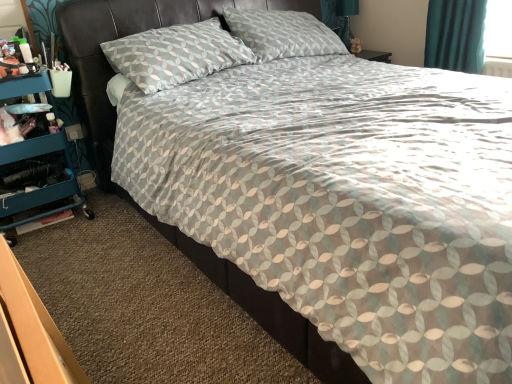
Question: Should I look upward or downward to see teal fabric curtain at upper right?

Choices:
 (A) down
 (B) up

Answer: (B)

Question: Does teal plastic cart at left lie behind teal fabric curtain at upper right?

Choices:
 (A) yes
 (B) no

Answer: (B)

Question: Is teal fabric curtain at upper right completely or partially inside teal plastic cart at left?

Choices:
 (A) yes
 (B) no

Answer: (B)

Question: Considering the relative sizes of teal plastic cart at left and teal fabric curtain at upper right in the image provided, is teal plastic cart at left bigger than teal fabric curtain at upper right?

Choices:
 (A) no
 (B) yes

Answer: (B)

Question: Can you confirm if teal plastic cart at left is taller than teal fabric curtain at upper right?

Choices:
 (A) yes
 (B) no

Answer: (A)

Question: Considering the relative sizes of teal plastic cart at left and teal fabric curtain at upper right in the image provided, is teal plastic cart at left shorter than teal fabric curtain at upper right?

Choices:
 (A) yes
 (B) no

Answer: (B)

Question: From a real-world perspective, is teal plastic cart at left located beneath teal fabric curtain at upper right?

Choices:
 (A) no
 (B) yes

Answer: (B)

Question: Are teal fabric curtain at upper right and teal plastic cart at left located far from each other?

Choices:
 (A) yes
 (B) no

Answer: (A)

Question: From the image's perspective, is teal fabric curtain at upper right above teal plastic cart at left?

Choices:
 (A) no
 (B) yes

Answer: (B)

Question: Does teal fabric curtain at upper right have a smaller size compared to teal plastic cart at left?

Choices:
 (A) no
 (B) yes

Answer: (B)

Question: Does teal fabric curtain at upper right lie behind teal plastic cart at left?

Choices:
 (A) yes
 (B) no

Answer: (A)

Question: Does teal fabric curtain at upper right have a larger size compared to teal plastic cart at left?

Choices:
 (A) yes
 (B) no

Answer: (B)

Question: Does teal fabric curtain at upper right appear on the left side of teal plastic cart at left?

Choices:
 (A) yes
 (B) no

Answer: (B)

Question: Is teal fabric curtain at upper right spatially inside teal plastic cart at left, or outside of it?

Choices:
 (A) inside
 (B) outside

Answer: (B)